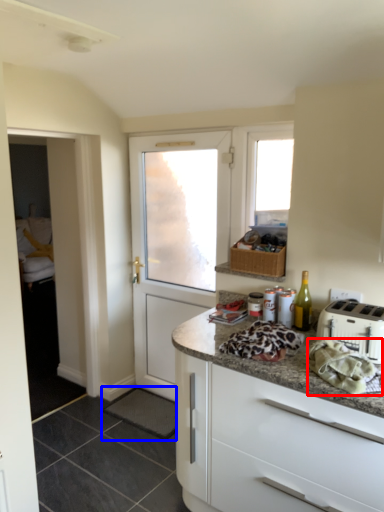
Question: Which of the following is the farthest to the observer, material (highlighted by a red box) or tile (highlighted by a blue box)?

Choices:
 (A) material
 (B) tile

Answer: (B)